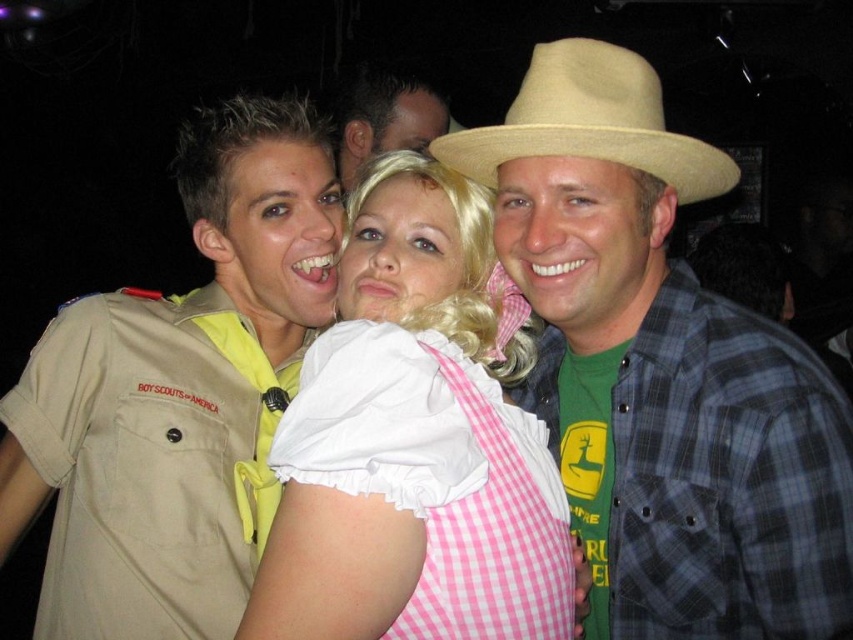
From the picture: Can you confirm if tan uniform at left is taller than beige straw cowboy hat at center?

Yes.

Who is shorter, tan uniform at left or beige straw cowboy hat at center?

beige straw cowboy hat at center is shorter.

The height and width of the screenshot is (640, 853). Describe the element at coordinates (177, 394) in the screenshot. I see `tan uniform at left` at that location.

Locate an element on the screen. Image resolution: width=853 pixels, height=640 pixels. tan uniform at left is located at coordinates (177, 394).

Is pink gingham dress at center in front of beige straw cowboy hat at center?

Yes, pink gingham dress at center is in front of beige straw cowboy hat at center.

Is pink gingham dress at center to the left of beige straw cowboy hat at center from the viewer's perspective?

Correct, you'll find pink gingham dress at center to the left of beige straw cowboy hat at center.

Is point (311, 365) more distant than point (688, 148)?

No.

Where is `pink gingham dress at center`? This screenshot has height=640, width=853. pink gingham dress at center is located at coordinates (416, 440).

Which is more to the right, tan uniform at left or pink gingham dress at center?

From the viewer's perspective, pink gingham dress at center appears more on the right side.

Does tan uniform at left come in front of pink gingham dress at center?

No.

Which is in front, point (161, 445) or point (357, 445)?

Point (357, 445) is more forward.

Where is `tan uniform at left`? This screenshot has width=853, height=640. tan uniform at left is located at coordinates (177, 394).